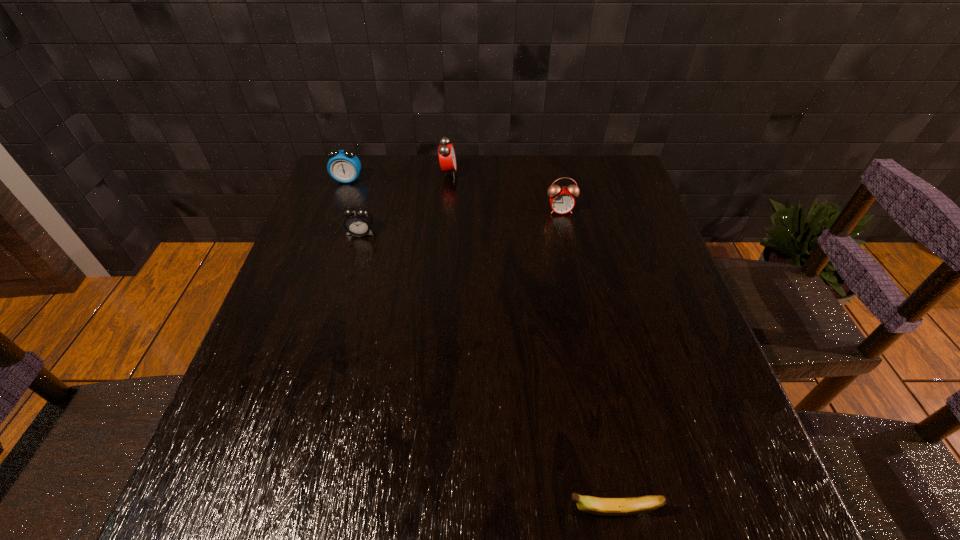
Image resolution: width=960 pixels, height=540 pixels. I want to click on free space located on the front side of the nearest alarm clock, so pyautogui.click(x=354, y=254).

Where is `vacant space situated at the stem of the banana`? vacant space situated at the stem of the banana is located at coordinates (343, 511).

Where is `vacant region located 0.290m at the stem of the banana`? vacant region located 0.290m at the stem of the banana is located at coordinates (381, 511).

The height and width of the screenshot is (540, 960). I want to click on vacant space located at the stem of the banana, so click(x=420, y=511).

Find the location of a particular element. The height and width of the screenshot is (540, 960). object that is at the near edge is located at coordinates point(599,506).

I want to click on object at the far left corner, so click(344, 166).

Find the location of `free space at the far edge`. free space at the far edge is located at coordinates (416, 197).

The image size is (960, 540). What are the coordinates of `free space at the near edge of the desktop` in the screenshot? It's located at (x=440, y=488).

At what (x,y) coordinates should I click in order to perform the action: click on free space at the left edge of the desktop. Please return your answer as a coordinate pair (x, y). Image resolution: width=960 pixels, height=540 pixels. Looking at the image, I should click on (313, 396).

At what (x,y) coordinates should I click in order to perform the action: click on vacant space at the right edge. Please return your answer as a coordinate pair (x, y). The image size is (960, 540). Looking at the image, I should click on (653, 295).